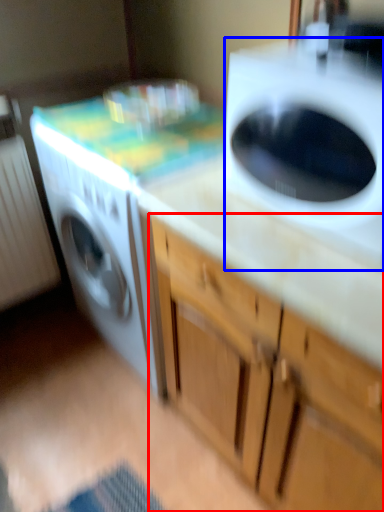
Question: Which point is closer to the camera, cabinetry (highlighted by a red box) or washing machine (highlighted by a blue box)?

Choices:
 (A) cabinetry
 (B) washing machine

Answer: (A)